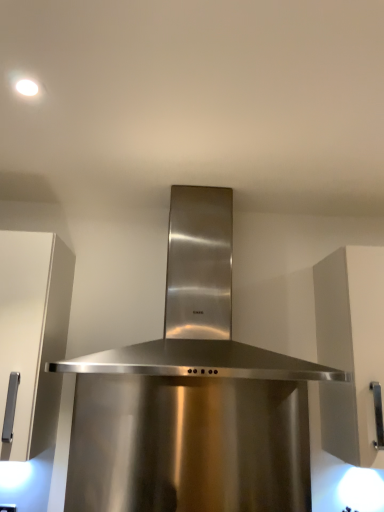
Describe the element at coordinates (350, 349) in the screenshot. I see `white matte cabinet at right` at that location.

You are a GUI agent. You are given a task and a screenshot of the screen. Output one action in this format:
    pyautogui.click(x=<x>, y=<y>)
    Task: Click on the white matte cabinet at right
    Image resolution: width=384 pixels, height=512 pixels.
    Given the screenshot: What is the action you would take?
    pyautogui.click(x=350, y=349)

What do you see at coordinates (192, 395) in the screenshot? I see `stainless steel range hood at center` at bounding box center [192, 395].

The width and height of the screenshot is (384, 512). I want to click on stainless steel range hood at center, so click(x=192, y=395).

Identify the location of white matte cabinet at right. This screenshot has width=384, height=512. (350, 349).

Consider the image. Which object is positioned more to the right, white matte cabinet at right or stainless steel range hood at center?

white matte cabinet at right is more to the right.

Considering their positions, is white matte cabinet at right located in front of or behind stainless steel range hood at center?

white matte cabinet at right is positioned farther from the viewer than stainless steel range hood at center.

Is point (358, 304) less distant than point (198, 219)?

Yes.

From the image's perspective, is white matte cabinet at right above or below stainless steel range hood at center?

white matte cabinet at right is below stainless steel range hood at center.

From a real-world perspective, relative to stainless steel range hood at center, is white matte cabinet at right vertically above or below?

Clearly, from a real-world perspective, white matte cabinet at right is below stainless steel range hood at center.

Considering the sizes of white matte cabinet at right and stainless steel range hood at center in the image, is white matte cabinet at right wider or thinner than stainless steel range hood at center?

In the image, white matte cabinet at right appears to be more narrow than stainless steel range hood at center.

Does white matte cabinet at right have a greater height compared to stainless steel range hood at center?

Yes.

Considering the relative sizes of white matte cabinet at right and stainless steel range hood at center in the image provided, is white matte cabinet at right bigger than stainless steel range hood at center?

Incorrect, white matte cabinet at right is not larger than stainless steel range hood at center.

In the scene shown: Is white matte cabinet at right not within stainless steel range hood at center?

white matte cabinet at right lies outside stainless steel range hood at center's area.

Is white matte cabinet at right directly adjacent to stainless steel range hood at center?

No, white matte cabinet at right is not beside stainless steel range hood at center.

Is white matte cabinet at right positioned with its back to stainless steel range hood at center?

No, stainless steel range hood at center is not at the back of white matte cabinet at right.

Can you tell me how much white matte cabinet at right and stainless steel range hood at center differ in facing direction?

The angular difference between white matte cabinet at right and stainless steel range hood at center is 0.279 degrees.

At what (x,y) coordinates should I click in order to perform the action: click on home appliance that appears in front of the white matte cabinet at right. Please return your answer as a coordinate pair (x, y). The width and height of the screenshot is (384, 512). Looking at the image, I should click on (192, 395).

Is stainless steel range hood at center at the right side of white matte cabinet at right?

No.

Does stainless steel range hood at center come behind white matte cabinet at right?

No.

Which is less distant, (185, 437) or (328, 298)?

Point (185, 437).

From the image's perspective, which object appears higher, stainless steel range hood at center or white matte cabinet at right?

stainless steel range hood at center appears higher in the image.

From a real-world perspective, is stainless steel range hood at center over white matte cabinet at right?

Yes, from a real-world perspective, stainless steel range hood at center is over white matte cabinet at right

Can you confirm if stainless steel range hood at center is thinner than white matte cabinet at right?

No, stainless steel range hood at center is not thinner than white matte cabinet at right.

Does stainless steel range hood at center have a greater height compared to white matte cabinet at right?

No, stainless steel range hood at center is not taller than white matte cabinet at right.

Considering the sizes of objects stainless steel range hood at center and white matte cabinet at right in the image provided, who is smaller, stainless steel range hood at center or white matte cabinet at right?

white matte cabinet at right is smaller.

In the scene shown: Choose the correct answer: Is stainless steel range hood at center inside white matte cabinet at right or outside it?

stainless steel range hood at center is outside white matte cabinet at right.

Would you consider stainless steel range hood at center to be distant from white matte cabinet at right?

No, stainless steel range hood at center is not far from white matte cabinet at right.

Is stainless steel range hood at center positioned with its back to white matte cabinet at right?

No, stainless steel range hood at center's orientation is not away from white matte cabinet at right.

Looking at this image, can you tell me how much stainless steel range hood at center and white matte cabinet at right differ in facing direction?

stainless steel range hood at center and white matte cabinet at right are facing 0.279 degrees away from each other.

Find the location of a particular element. The image size is (384, 512). cabinetry below the stainless steel range hood at center (from the image's perspective) is located at coordinates (350, 349).

Find the location of `home appliance above the white matte cabinet at right (from the image's perspective)`. home appliance above the white matte cabinet at right (from the image's perspective) is located at coordinates (192, 395).

Where is `cabinetry on the right side of stainless steel range hood at center`? This screenshot has width=384, height=512. cabinetry on the right side of stainless steel range hood at center is located at coordinates (350, 349).